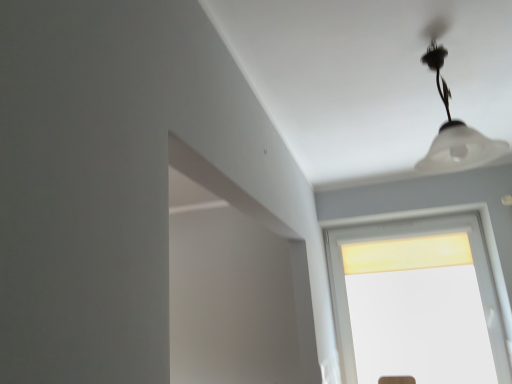
Question: Is white frosted lampshade at upper center in front of or behind matte yellow glass window at center in the image?

Choices:
 (A) behind
 (B) front

Answer: (B)

Question: In the image, is white frosted lampshade at upper center on the left side or the right side of matte yellow glass window at center?

Choices:
 (A) left
 (B) right

Answer: (A)

Question: Is point click(449, 119) closer or farther from the camera than point click(373, 226)?

Choices:
 (A) farther
 (B) closer

Answer: (B)

Question: Based on their positions, is matte yellow glass window at center located to the left or right of white frosted lampshade at upper center?

Choices:
 (A) right
 (B) left

Answer: (A)

Question: Do you think matte yellow glass window at center is within white frosted lampshade at upper center, or outside of it?

Choices:
 (A) outside
 (B) inside

Answer: (A)

Question: Looking at the image, does matte yellow glass window at center seem bigger or smaller compared to white frosted lampshade at upper center?

Choices:
 (A) big
 (B) small

Answer: (A)

Question: Considering the positions of matte yellow glass window at center and white frosted lampshade at upper center in the image, is matte yellow glass window at center wider or thinner than white frosted lampshade at upper center?

Choices:
 (A) wide
 (B) thin

Answer: (B)